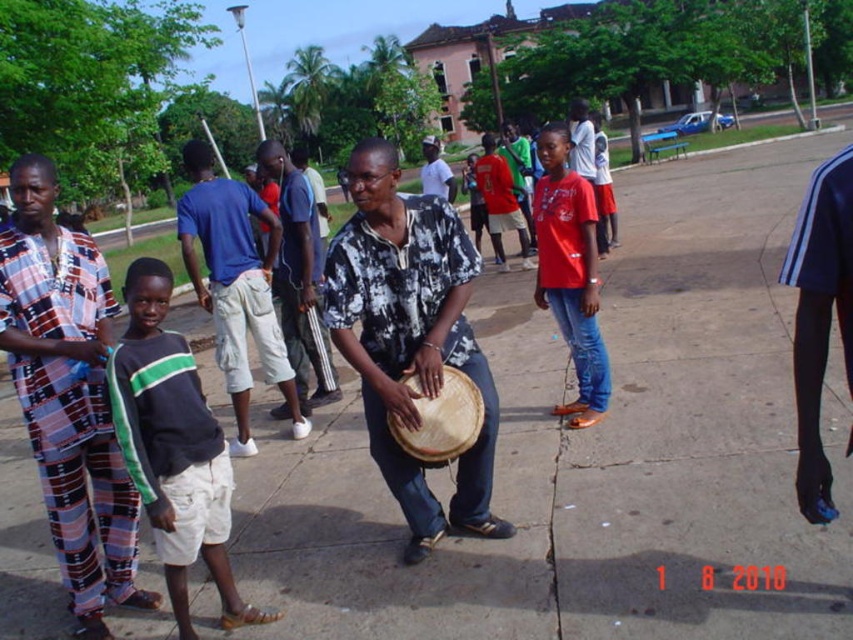
Can you confirm if dark gray-green striped shirt at left is positioned above natural woven drum at center?

Incorrect, dark gray-green striped shirt at left is not positioned above natural woven drum at center.

Which is in front, point (109, 369) or point (445, 428)?

Point (109, 369) is more forward.

The height and width of the screenshot is (640, 853). I want to click on dark gray-green striped shirt at left, so click(173, 448).

Based on the photo, does matte black shirt at center appear over dark gray-green striped shirt at left?

Yes.

Which is in front, point (351, 186) or point (175, 477)?

Point (175, 477)

Does point (347, 262) come behind point (207, 504)?

Yes, point (347, 262) is farther from viewer.

At what (x,y) coordinates should I click in order to perform the action: click on matte black shirt at center. Please return your answer as a coordinate pair (x, y). The height and width of the screenshot is (640, 853). Looking at the image, I should click on (410, 337).

Measure the distance between dark gray-green striped shirt at left and camera.

A distance of 9.73 feet exists between dark gray-green striped shirt at left and camera.

Does dark gray-green striped shirt at left have a greater width compared to red matte shirt at center?

Yes.

What do you see at coordinates (173, 448) in the screenshot?
I see `dark gray-green striped shirt at left` at bounding box center [173, 448].

This screenshot has width=853, height=640. I want to click on dark gray-green striped shirt at left, so click(173, 448).